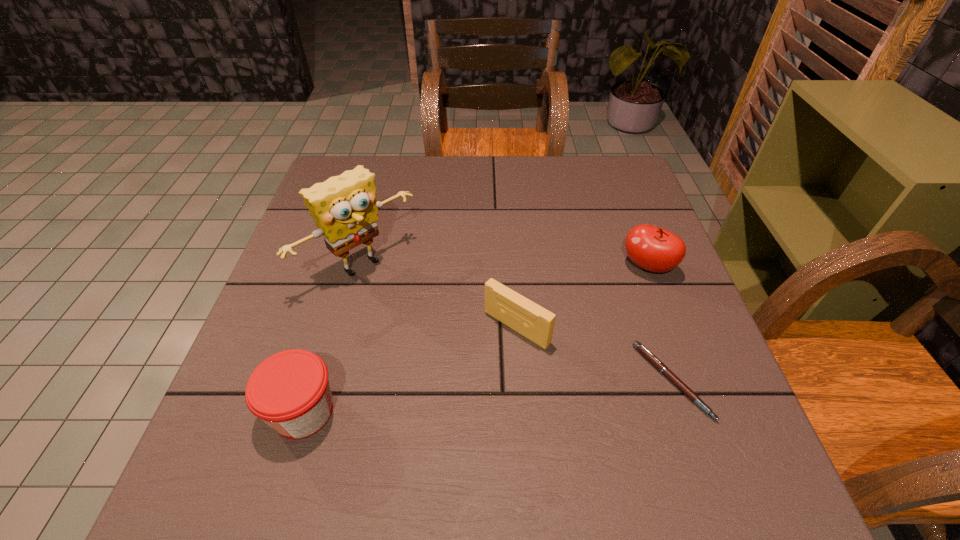
This screenshot has width=960, height=540. In order to click on the third tallest object in this screenshot , I will do `click(290, 391)`.

In order to click on pen in this screenshot , I will do pyautogui.click(x=658, y=364).

Where is `apple`? apple is located at coordinates (652, 248).

You are a GUI agent. You are given a task and a screenshot of the screen. Output one action in this format:
    pyautogui.click(x=<x>, y=<y>)
    Task: Click on the videotape
    The height and width of the screenshot is (540, 960).
    Given the screenshot: What is the action you would take?
    pyautogui.click(x=536, y=323)

Find the location of `the third object from left to right`. the third object from left to right is located at coordinates (536, 323).

Locate an element on the screen. The height and width of the screenshot is (540, 960). sponge is located at coordinates (345, 207).

Where is `vacant position located 0.060m on the label side of the jam`? The width and height of the screenshot is (960, 540). vacant position located 0.060m on the label side of the jam is located at coordinates (232, 411).

This screenshot has height=540, width=960. Find the location of `free space located on the stem of the apple`. free space located on the stem of the apple is located at coordinates (572, 348).

Locate an element on the screen. This screenshot has width=960, height=540. vacant position located 0.270m on the stem of the apple is located at coordinates (566, 354).

Where is `free space located on the stem of the apple`? free space located on the stem of the apple is located at coordinates (611, 305).